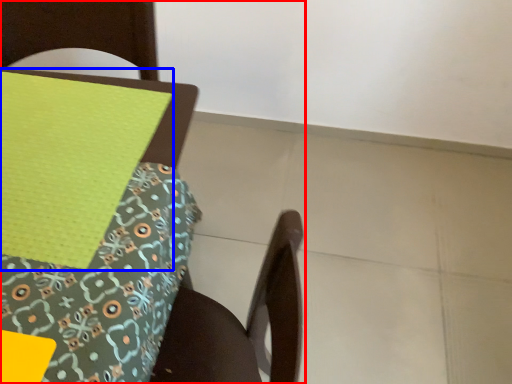
Question: Which point is further to the camera, chair (highlighted by a red box) or sheet (highlighted by a blue box)?

Choices:
 (A) chair
 (B) sheet

Answer: (B)